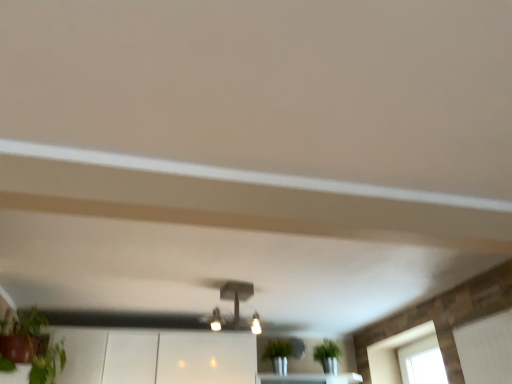
Image resolution: width=512 pixels, height=384 pixels. Describe the element at coordinates (394, 353) in the screenshot. I see `transparent glass window at lower right` at that location.

Locate an element on the screen. transparent glass window at lower right is located at coordinates (394, 353).

Find the location of `matte black light fixture at center`. matte black light fixture at center is located at coordinates (239, 301).

Describe the element at coordinates (239, 301) in the screenshot. I see `matte black light fixture at center` at that location.

What is the approximate height of matte black light fixture at center?

It is 8.91 inches.

Locate an element on the screen. The image size is (512, 384). transparent glass window at lower right is located at coordinates (394, 353).

From the picture: Considering the positions of objects transparent glass window at lower right and matte black light fixture at center in the image provided, who is more to the left, transparent glass window at lower right or matte black light fixture at center?

From the viewer's perspective, matte black light fixture at center appears more on the left side.

Is the position of transparent glass window at lower right more distant than that of matte black light fixture at center?

Yes, transparent glass window at lower right is behind matte black light fixture at center.

Considering the points (400, 344) and (253, 319), which point is in front, point (400, 344) or point (253, 319)?

The point (253, 319) is closer to the camera.

From the image's perspective, is transparent glass window at lower right located above matte black light fixture at center?

No, from the image's perspective, transparent glass window at lower right is not above matte black light fixture at center.

Consider the image. From a real-world perspective, is transparent glass window at lower right physically located above or below matte black light fixture at center?

transparent glass window at lower right is below matte black light fixture at center.

From the picture: Can you confirm if transparent glass window at lower right is wider than matte black light fixture at center?

In fact, transparent glass window at lower right might be narrower than matte black light fixture at center.

Consider the image. Who is shorter, transparent glass window at lower right or matte black light fixture at center?

matte black light fixture at center is shorter.

Is transparent glass window at lower right smaller than matte black light fixture at center?

Actually, transparent glass window at lower right might be larger than matte black light fixture at center.

Is matte black light fixture at center completely or partially inside transparent glass window at lower right?

No.

Would you say transparent glass window at lower right is a long distance from matte black light fixture at center?

Absolutely, transparent glass window at lower right is distant from matte black light fixture at center.

Based on the photo, is transparent glass window at lower right positioned with its back to matte black light fixture at center?

No, transparent glass window at lower right is not facing away from matte black light fixture at center.

How much distance is there between transparent glass window at lower right and matte black light fixture at center?

transparent glass window at lower right is 3.47 feet away from matte black light fixture at center.

You are a GUI agent. You are given a task and a screenshot of the screen. Output one action in this format:
    pyautogui.click(x=<x>, y=<y>)
    Task: Click on the light fixture above the transparent glass window at lower right (from the image's perspective)
    
    Given the screenshot: What is the action you would take?
    pyautogui.click(x=239, y=301)

Is matte black light fixture at center to the left of transparent glass window at lower right from the viewer's perspective?

Yes.

Is the position of matte black light fixture at center less distant than that of transparent glass window at lower right?

Yes, it is in front of transparent glass window at lower right.

Considering the points (243, 294) and (436, 341), which point is in front, point (243, 294) or point (436, 341)?

Positioned in front is point (243, 294).

From the image's perspective, is matte black light fixture at center located above or below transparent glass window at lower right?

matte black light fixture at center is situated higher than transparent glass window at lower right in the image.

From the picture: From a real-world perspective, between matte black light fixture at center and transparent glass window at lower right, who is vertically higher?

matte black light fixture at center is physically above.

Between matte black light fixture at center and transparent glass window at lower right, which one has larger width?

matte black light fixture at center is wider.

Between matte black light fixture at center and transparent glass window at lower right, which one has less height?

matte black light fixture at center.

Considering the sizes of objects matte black light fixture at center and transparent glass window at lower right in the image provided, who is smaller, matte black light fixture at center or transparent glass window at lower right?

Smaller between the two is matte black light fixture at center.

Consider the image. Is transparent glass window at lower right located within matte black light fixture at center?

No.

Is matte black light fixture at center placed right next to transparent glass window at lower right?

matte black light fixture at center is not next to transparent glass window at lower right, and they're not touching.

Does matte black light fixture at center turn towards transparent glass window at lower right?

No, matte black light fixture at center is not aimed at transparent glass window at lower right.

Where is `window lying on the right of matte black light fixture at center`? Image resolution: width=512 pixels, height=384 pixels. window lying on the right of matte black light fixture at center is located at coordinates (394, 353).

At what (x,y) coordinates should I click in order to perform the action: click on window below the matte black light fixture at center (from the image's perspective). Please return your answer as a coordinate pair (x, y). The width and height of the screenshot is (512, 384). Looking at the image, I should click on (394, 353).

This screenshot has height=384, width=512. In order to click on light fixture in front of the transparent glass window at lower right in this screenshot , I will do `click(239, 301)`.